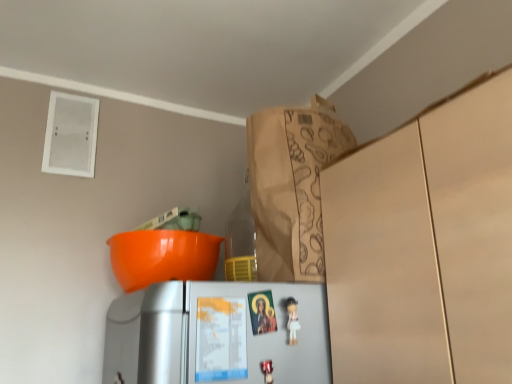
What do you see at coordinates (217, 334) in the screenshot? I see `white matte refrigerator at lower center` at bounding box center [217, 334].

Measure the distance between brown paper bag at upper center and camera.

brown paper bag at upper center is 35.66 inches away from camera.

Image resolution: width=512 pixels, height=384 pixels. I want to click on white glossy figurine at center, so tap(292, 319).

Find the location of a particular element. This screenshot has height=384, width=512. white matte refrigerator at lower center is located at coordinates (217, 334).

From a real-world perspective, is white matte refrigerator at lower center physically below brown paper bag at upper center?

Yes, from a real-world perspective, white matte refrigerator at lower center is beneath brown paper bag at upper center.

Which object is wider, white matte refrigerator at lower center or brown paper bag at upper center?

With larger width is brown paper bag at upper center.

Does white matte refrigerator at lower center have a smaller size compared to brown paper bag at upper center?

Indeed, white matte refrigerator at lower center has a smaller size compared to brown paper bag at upper center.

Does white matte refrigerator at lower center turn towards brown paper bag at upper center?

No, white matte refrigerator at lower center does not turn towards brown paper bag at upper center.

Would you say brown paper bag at upper center is inside or outside white glossy figurine at center?

brown paper bag at upper center is not inside white glossy figurine at center, it's outside.

Considering their positions, is brown paper bag at upper center located in front of or behind white glossy figurine at center?

Clearly, brown paper bag at upper center is behind white glossy figurine at center.

Can you tell me how much brown paper bag at upper center and white glossy figurine at center differ in facing direction?

They differ by 90 degrees in their facing directions.

Between white glossy figurine at center and white matte refrigerator at lower center, which one has smaller size?

white glossy figurine at center is smaller.

Is white glossy figurine at center looking in the opposite direction of white matte refrigerator at lower center?

Yes.

From a real-world perspective, is white glossy figurine at center above or below white matte refrigerator at lower center?

From a real-world perspective, white glossy figurine at center is physically above white matte refrigerator at lower center.

From the image's perspective, is white glossy figurine at center positioned above or below white matte refrigerator at lower center?

Based on their image positions, white glossy figurine at center is located above white matte refrigerator at lower center.

Considering their positions, is white glossy figurine at center located in front of or behind brown paper bag at upper center?

Clearly, white glossy figurine at center is in front of brown paper bag at upper center.

From the image's perspective, between white glossy figurine at center and brown paper bag at upper center, who is located below?

From the image's view, white glossy figurine at center is below.

Is white glossy figurine at center to the right of brown paper bag at upper center from the viewer's perspective?

Indeed, white glossy figurine at center is positioned on the right side of brown paper bag at upper center.

In the scene shown: Who is taller, white glossy figurine at center or brown paper bag at upper center?

brown paper bag at upper center is taller.

Is brown paper bag at upper center not close to white matte refrigerator at lower center?

brown paper bag at upper center is actually quite close to white matte refrigerator at lower center.

Can you confirm if brown paper bag at upper center is smaller than white matte refrigerator at lower center?

No.

From the image's perspective, which one is positioned lower, brown paper bag at upper center or white matte refrigerator at lower center?

white matte refrigerator at lower center appears lower in the image.

Measure the distance between white matte refrigerator at lower center and white glossy figurine at center.

A distance of 4.60 inches exists between white matte refrigerator at lower center and white glossy figurine at center.

Considering the relative positions of white matte refrigerator at lower center and white glossy figurine at center in the image provided, is white matte refrigerator at lower center to the right of white glossy figurine at center from the viewer's perspective?

No, white matte refrigerator at lower center is not to the right of white glossy figurine at center.

Which object is further away from the camera, white matte refrigerator at lower center or white glossy figurine at center?

white glossy figurine at center is further away from the camera.

The width and height of the screenshot is (512, 384). I want to click on paper bag that is above the white matte refrigerator at lower center (from a real-world perspective), so click(x=291, y=186).

The image size is (512, 384). What are the coordinates of `paper bag lying above the white glossy figurine at center (from the image's perspective)` in the screenshot? It's located at tap(291, 186).

Estimate the real-world distances between objects in this image. Which object is closer to white glossy figurine at center, brown paper bag at upper center or white matte refrigerator at lower center?

white matte refrigerator at lower center is positioned closer to the anchor white glossy figurine at center.

From the image, which object appears to be nearer to brown paper bag at upper center, white glossy figurine at center or white matte refrigerator at lower center?

Based on the image, white matte refrigerator at lower center appears to be nearer to brown paper bag at upper center.

From the image, which object appears to be nearer to brown paper bag at upper center, white matte refrigerator at lower center or white glossy figurine at center?

Based on the image, white matte refrigerator at lower center appears to be nearer to brown paper bag at upper center.

Based on their spatial positions, is white matte refrigerator at lower center or brown paper bag at upper center closer to white glossy figurine at center?

Based on the image, white matte refrigerator at lower center appears to be nearer to white glossy figurine at center.

When comparing their distances from white matte refrigerator at lower center, does brown paper bag at upper center or white glossy figurine at center seem further?

brown paper bag at upper center lies further to white matte refrigerator at lower center than the other object.

Looking at this image, when comparing their distances from white matte refrigerator at lower center, does white glossy figurine at center or brown paper bag at upper center seem further?

brown paper bag at upper center is positioned further to the anchor white matte refrigerator at lower center.

The image size is (512, 384). I want to click on toy between brown paper bag at upper center and white matte refrigerator at lower center from top to bottom, so click(x=292, y=319).